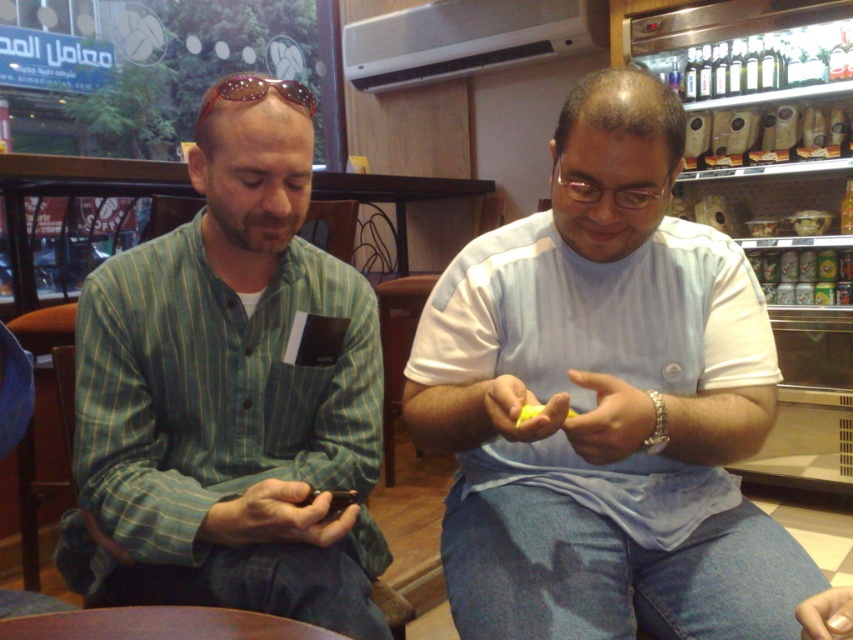
Question: Where is green striped shirt at left located in relation to sunglasses at upper center in the image?

Choices:
 (A) above
 (B) below

Answer: (B)

Question: Which object is closer to the camera taking this photo?

Choices:
 (A) green striped shirt at left
 (B) light blue cotton shirt at center
 (C) sunglasses at upper center

Answer: (B)

Question: Which point is closer to the camera?

Choices:
 (A) (363, 600)
 (B) (457, 580)

Answer: (B)

Question: Considering the relative positions of green striped shirt at left and sunglasses at upper center in the image provided, where is green striped shirt at left located with respect to sunglasses at upper center?

Choices:
 (A) left
 (B) right

Answer: (A)

Question: Estimate the real-world distances between objects in this image. Which object is closer to the light blue cotton shirt at center?

Choices:
 (A) green striped shirt at left
 (B) sunglasses at upper center

Answer: (A)

Question: Observing the image, what is the correct spatial positioning of light blue cotton shirt at center in reference to sunglasses at upper center?

Choices:
 (A) left
 (B) right

Answer: (B)